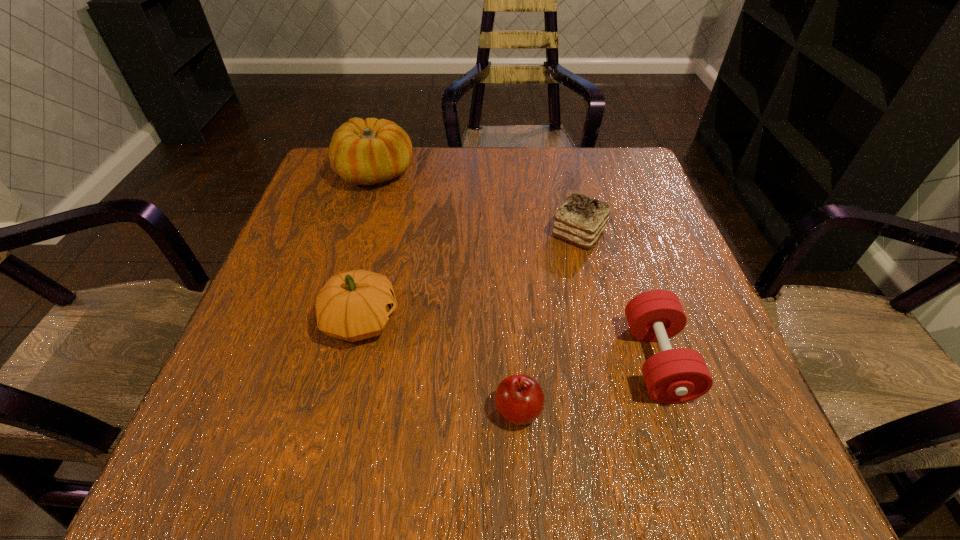
The width and height of the screenshot is (960, 540). What are the coordinates of `vacant space at the near right corner` in the screenshot? It's located at (673, 490).

Where is `empty space that is in between the third object from right to left and the dumbbell`? The image size is (960, 540). empty space that is in between the third object from right to left and the dumbbell is located at coordinates (588, 386).

Locate an element on the screen. free spot between the farther gourd and the dumbbell is located at coordinates pyautogui.click(x=516, y=267).

The height and width of the screenshot is (540, 960). Identify the location of free space between the farthest object and the chocolate cake. (477, 203).

The height and width of the screenshot is (540, 960). Find the location of `vacant space in between the third object from left to right and the nearer gourd`. vacant space in between the third object from left to right and the nearer gourd is located at coordinates (440, 366).

Image resolution: width=960 pixels, height=540 pixels. What are the coordinates of `vacant region between the nearer gourd and the chocolate cake` in the screenshot? It's located at (469, 276).

Locate an element on the screen. free spot between the farther gourd and the third object from right to left is located at coordinates (446, 292).

Where is `free space between the third object from left to right and the fourth nearest object`? The image size is (960, 540). free space between the third object from left to right and the fourth nearest object is located at coordinates (548, 322).

What are the coordinates of `blank region between the nearer gourd and the chocolate cake` in the screenshot? It's located at (469, 276).

Where is `free space between the dumbbell and the fourth nearest object`? Image resolution: width=960 pixels, height=540 pixels. free space between the dumbbell and the fourth nearest object is located at coordinates (618, 297).